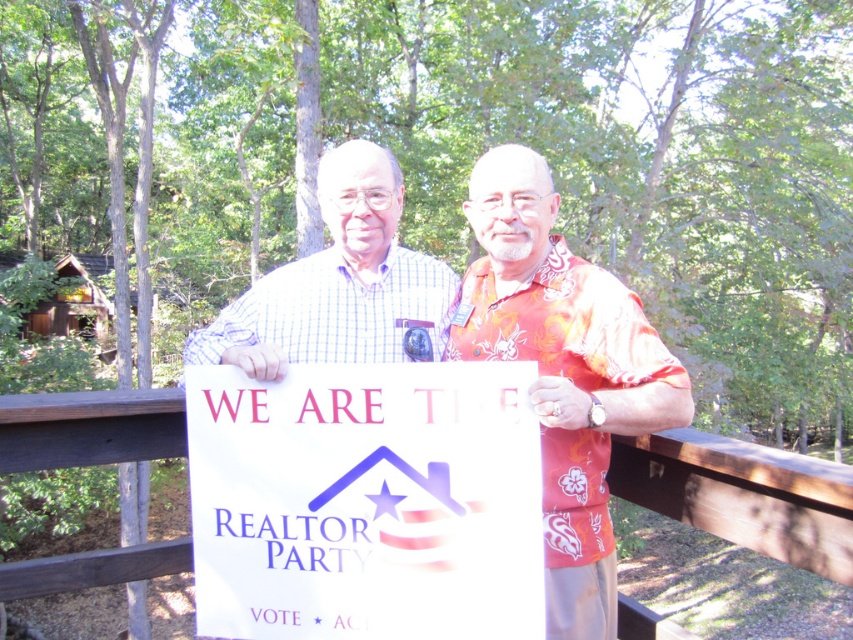
You are a photographer trying to capture the white paper sign at center and the wooden rail at center in a single frame. Based on their positions, which object should you adjust your camera to focus on first to ensure both are in the frame?

The white paper sign at center is to the left of the wooden rail at center, so you should focus on the wooden rail at center first to ensure both are captured in the frame.

You are a photographer trying to capture a clear shot of the white paper sign at center and the wooden rail at center. Which object is closer to the camera, making it appear larger in the photo?

The white paper sign at center is closer to the camera, so it appears larger than the wooden rail at center in the photo because it is further away.

Consider the image. You are a photographer trying to capture a clear shot of the white paper sign at center and the wooden rail at center. Given that your camera has a depth of field that can sharply focus on objects within a 30 inch range, will both objects be in focus simultaneously?

The white paper sign at center and wooden rail at center are 30.34 inches apart. Since the distance between them exceeds the camera s 30 inch depth of field range, both objects cannot be in focus at the same time.